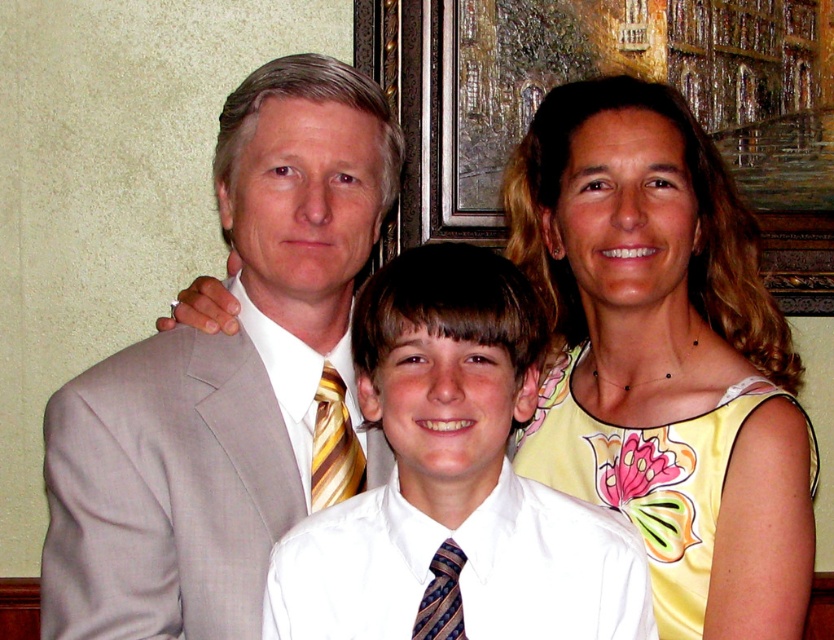
Question: Can you confirm if white satin shirt at center is positioned to the right of yellow striped tie at center?

Choices:
 (A) yes
 (B) no

Answer: (A)

Question: Is yellow satin dress at upper right to the left of yellow striped tie at center from the viewer's perspective?

Choices:
 (A) no
 (B) yes

Answer: (A)

Question: Can you confirm if yellow satin dress at upper right is bigger than white satin shirt at center?

Choices:
 (A) no
 (B) yes

Answer: (B)

Question: Which point is closer to the camera?

Choices:
 (A) (330, 444)
 (B) (149, 403)

Answer: (B)

Question: Which object is positioned farthest from the light gray suit at center?

Choices:
 (A) white satin shirt at center
 (B) multicolored silk tie at center
 (C) yellow striped tie at center
 (D) yellow satin dress at upper right

Answer: (B)

Question: Which object appears farthest from the camera in this image?

Choices:
 (A) yellow satin dress at upper right
 (B) yellow striped tie at center

Answer: (B)